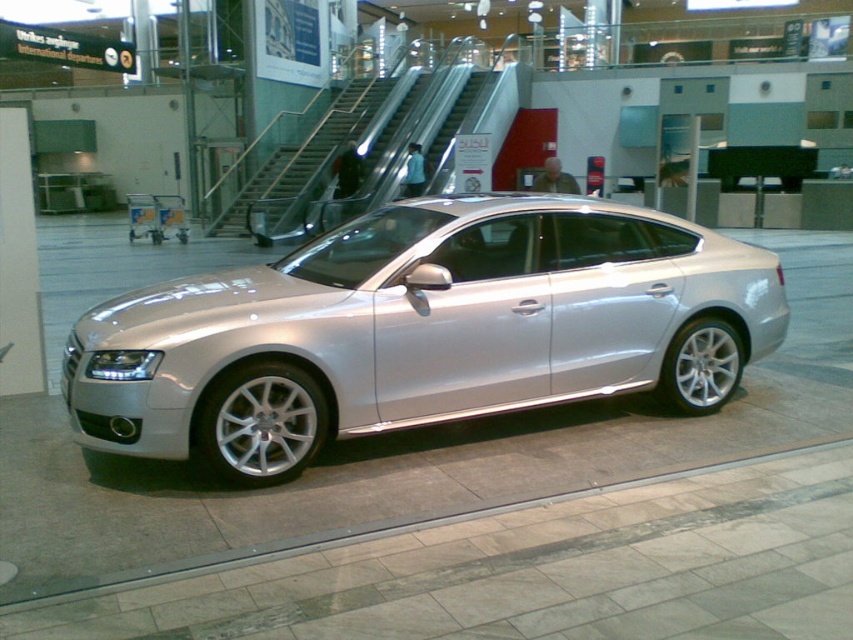
You are a passenger at the airport terminal and want to board a flight. You see the silver metallic car at center and the metallic silver escalator at center. Which one is closer to the ground floor?

The silver metallic car at center is located below the metallic silver escalator at center, so it is closer to the ground floor.

You are a parking attendant at the airport and need to guide a driver to park their car. The driver asks if their silver metallic car at center can fit into a parking spot that is as wide as the metallic silver escalator at center. Based on the scene, what would you tell them?

The silver metallic car at center has a lesser width compared to the metallic silver escalator at center, so it will fit into the parking spot.

As a passenger in the airport terminal, you want to locate the silver Audi A5 parked at the center. Using the coordinate system where the bottom left corner is the origin, can you confirm if the silver metallic car at center is exactly at point (421, 330)?

Yes, the silver metallic car at center is represented by point (421, 330) according to the coordinates provided.